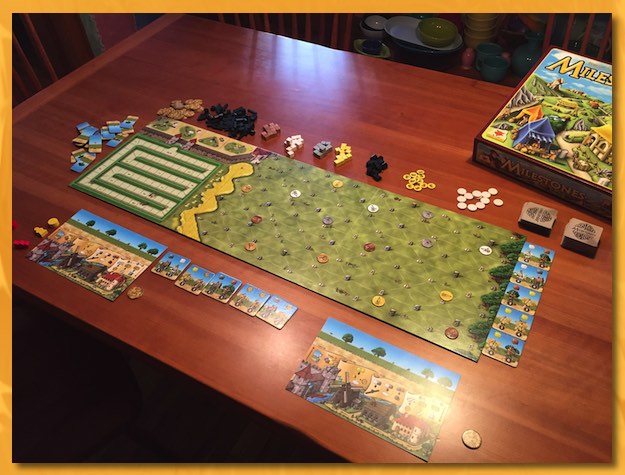
The width and height of the screenshot is (625, 475). I want to click on back of chair, so click(x=27, y=67), click(x=304, y=26), click(x=588, y=33).